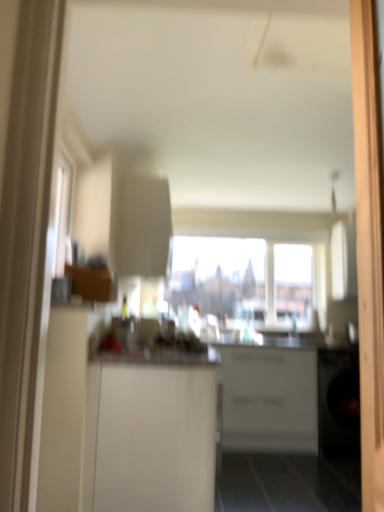
This screenshot has width=384, height=512. Describe the element at coordinates (269, 399) in the screenshot. I see `white matte cabinet at center, which is the 1th cabinetry in back-to-front order` at that location.

Find the location of a particular element. This screenshot has height=512, width=384. white matte cabinet at center, the 2th cabinetry viewed from the front is located at coordinates (269, 399).

Is white matte cabinet at center, marked as the 1th cabinetry in a front-to-back arrangement, positioned with its back to transparent glass window at center?

No, white matte cabinet at center, marked as the 1th cabinetry in a front-to-back arrangement, is not facing away from transparent glass window at center.

Can you confirm if white matte cabinet at center, marked as the 1th cabinetry in a front-to-back arrangement, is thinner than transparent glass window at center?

Incorrect, the width of white matte cabinet at center, marked as the 1th cabinetry in a front-to-back arrangement, is not less than that of transparent glass window at center.

Considering the relative sizes of white matte cabinet at center, placed as the 2th cabinetry when sorted from back to front, and transparent glass window at center in the image provided, is white matte cabinet at center, placed as the 2th cabinetry when sorted from back to front, bigger than transparent glass window at center?

Correct, white matte cabinet at center, placed as the 2th cabinetry when sorted from back to front, is larger in size than transparent glass window at center.

Does point (339, 375) come farther from viewer compared to point (239, 403)?

No, (339, 375) is closer to viewer.

The width and height of the screenshot is (384, 512). I want to click on counter located on the left of white matte cabinet at center, which is the 1th cabinetry in back-to-front order, so click(288, 426).

Can you confirm if white glossy counter at center is positioned to the left of white matte cabinet at center, the 2th cabinetry viewed from the front?

Correct, you'll find white glossy counter at center to the left of white matte cabinet at center, the 2th cabinetry viewed from the front.

Which of these two, white glossy counter at center or white matte cabinet at center, which is the 1th cabinetry in back-to-front order, stands shorter?

Standing shorter between the two is white matte cabinet at center, which is the 1th cabinetry in back-to-front order.

Considering the points (194, 387) and (364, 187), which point is in front, point (194, 387) or point (364, 187)?

Point (364, 187)

Is white matte cabinet at center, marked as the 1th cabinetry in a front-to-back arrangement, in front of or behind wooden screen door at right in the image?

white matte cabinet at center, marked as the 1th cabinetry in a front-to-back arrangement, is positioned farther from the viewer than wooden screen door at right.

Considering the sizes of objects white matte cabinet at center, placed as the 2th cabinetry when sorted from back to front, and wooden screen door at right in the image provided, who is taller, white matte cabinet at center, placed as the 2th cabinetry when sorted from back to front, or wooden screen door at right?

wooden screen door at right is taller.

Between white matte cabinet at center, placed as the 2th cabinetry when sorted from back to front, and wooden screen door at right, which one has smaller width?

wooden screen door at right.

Between transparent glass window at center and wooden screen door at right, which one has smaller width?

With smaller width is wooden screen door at right.

Who is smaller, transparent glass window at center or wooden screen door at right?

wooden screen door at right.

Is the surface of transparent glass window at center in direct contact with wooden screen door at right?

They are not placed beside each other.

From a real-world perspective, who is located lower, transparent glass window at center or wooden screen door at right?

wooden screen door at right.

Based on the photo, how many degrees apart are the facing directions of wooden screen door at right and white glossy counter at center?

They differ by 176 degrees in their facing directions.

Does wooden screen door at right have a greater width compared to white glossy counter at center?

Incorrect, the width of wooden screen door at right does not surpass that of white glossy counter at center.

Is wooden screen door at right oriented away from white glossy counter at center?

No.

Considering the sizes of objects wooden screen door at right and transparent glass window at center in the image provided, who is taller, wooden screen door at right or transparent glass window at center?

wooden screen door at right is taller.

In the scene shown: What's the angular difference between wooden screen door at right and transparent glass window at center's facing directions?

93.5 degrees.

Is wooden screen door at right oriented away from transparent glass window at center?

No.

Which is less distant, (383, 327) or (249, 283)?

The point (383, 327) is closer to the camera.

Between white matte cabinet at center, which is the 1th cabinetry in back-to-front order, and white glossy counter at center, which one has larger width?

With larger width is white glossy counter at center.

Can you confirm if white matte cabinet at center, the 2th cabinetry viewed from the front, is shorter than white glossy counter at center?

Yes, white matte cabinet at center, the 2th cabinetry viewed from the front, is shorter than white glossy counter at center.

This screenshot has height=512, width=384. Find the location of `cabinetry below the white glossy counter at center (from the image's perspective)`. cabinetry below the white glossy counter at center (from the image's perspective) is located at coordinates (269, 399).

Does white matte cabinet at center, the 2th cabinetry viewed from the front, have a larger size compared to white glossy counter at center?

Actually, white matte cabinet at center, the 2th cabinetry viewed from the front, might be smaller than white glossy counter at center.

You are a GUI agent. You are given a task and a screenshot of the screen. Output one action in this format:
    pyautogui.click(x=<x>, y=<y>)
    Task: Click on the 2nd cabinetry counting from the left side of the transparent glass window at center
    
    Given the screenshot: What is the action you would take?
    pyautogui.click(x=151, y=433)

This screenshot has width=384, height=512. Find the location of `cabinetry below the white glossy counter at center (from a real-world perspective)`. cabinetry below the white glossy counter at center (from a real-world perspective) is located at coordinates (269, 399).

Based on the photo, from the image, which object appears to be nearer to wooden screen door at right, transparent glass window at center or white glossy counter at center?

Among the two, white glossy counter at center is located nearer to wooden screen door at right.

When comparing their distances from white matte cabinet at center, the 2th cabinetry viewed from the front, does white matte cabinet at center, marked as the 1th cabinetry in a front-to-back arrangement, or wooden screen door at right seem further?

wooden screen door at right lies further to white matte cabinet at center, the 2th cabinetry viewed from the front, than the other object.

Based on their spatial positions, is white matte cabinet at center, placed as the 2th cabinetry when sorted from back to front, or white glossy counter at center further from wooden screen door at right?

Based on the image, white glossy counter at center appears to be further to wooden screen door at right.

Which object lies nearer to the anchor point white glossy counter at center, transparent glass window at center or wooden screen door at right?

Among the two, transparent glass window at center is located nearer to white glossy counter at center.

Which object lies nearer to the anchor point transparent glass window at center, white matte cabinet at center, placed as the 2th cabinetry when sorted from back to front, or white glossy counter at center?

white glossy counter at center.

When comparing their distances from white glossy counter at center, does wooden screen door at right or white matte cabinet at center, the 2th cabinetry viewed from the front, seem further?

Among the two, wooden screen door at right is located further to white glossy counter at center.

From the image, which object appears to be farther from white glossy counter at center, white matte cabinet at center, placed as the 2th cabinetry when sorted from back to front, or transparent glass window at center?

Among the two, white matte cabinet at center, placed as the 2th cabinetry when sorted from back to front, is located further to white glossy counter at center.

When comparing their distances from transparent glass window at center, does white matte cabinet at center, marked as the 1th cabinetry in a front-to-back arrangement, or white matte cabinet at center, which is the 1th cabinetry in back-to-front order, seem closer?

white matte cabinet at center, which is the 1th cabinetry in back-to-front order.

Where is `counter between wooden screen door at right and white matte cabinet at center, which is the 1th cabinetry in back-to-front order, in the front-back direction`? Image resolution: width=384 pixels, height=512 pixels. counter between wooden screen door at right and white matte cabinet at center, which is the 1th cabinetry in back-to-front order, in the front-back direction is located at coordinates (288, 426).

The width and height of the screenshot is (384, 512). Find the location of `cabinetry between white matte cabinet at center, marked as the 1th cabinetry in a front-to-back arrangement, and transparent glass window at center from front to back`. cabinetry between white matte cabinet at center, marked as the 1th cabinetry in a front-to-back arrangement, and transparent glass window at center from front to back is located at coordinates (269, 399).

I want to click on cabinetry between wooden screen door at right and white matte cabinet at center, which is the 1th cabinetry in back-to-front order, from front to back, so click(x=151, y=433).

I want to click on cabinetry between white glossy counter at center and white matte cabinet at center, the 2th cabinetry viewed from the front, from front to back, so click(151, 433).